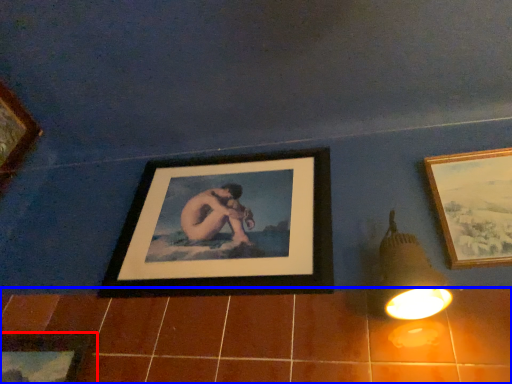
Question: Which object is further to the camera taking this photo, picture frame (highlighted by a red box) or ceramic tile (highlighted by a blue box)?

Choices:
 (A) picture frame
 (B) ceramic tile

Answer: (A)